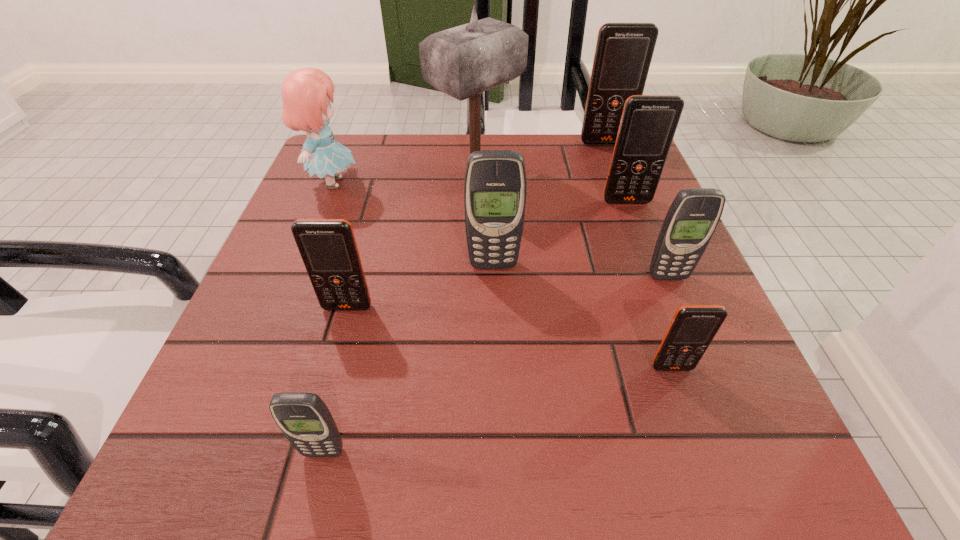
Identify the location of the second farthest gray cellular telephone. This screenshot has height=540, width=960. (694, 214).

Find the location of a particular element. The width and height of the screenshot is (960, 540). the second nearest orange cellular telephone is located at coordinates coord(328,248).

What are the coordinates of `the third nearest cellular telephone` in the screenshot? It's located at (328, 248).

Find the location of a particular element. The height and width of the screenshot is (540, 960). the eighth farthest object is located at coordinates point(693,327).

Where is `the second nearest cellular telephone`? This screenshot has width=960, height=540. the second nearest cellular telephone is located at coordinates (693, 327).

Image resolution: width=960 pixels, height=540 pixels. Identify the location of the nearest gray cellular telephone. (305, 420).

Locate an element on the screen. the smallest gray cellular telephone is located at coordinates (305, 420).

You are a GUI agent. You are given a task and a screenshot of the screen. Output one action in this format:
    pyautogui.click(x=<x>, y=<y>)
    Task: Click on the free region located 0.270m on the front of the mallet
    
    Given the screenshot: What is the action you would take?
    pyautogui.click(x=474, y=297)

Find the location of `free space located on the screen of the farthest orange cellular telephone`. free space located on the screen of the farthest orange cellular telephone is located at coordinates (615, 171).

This screenshot has width=960, height=540. Identify the location of free region located on the front-facing side of the blue doll. 388,183.